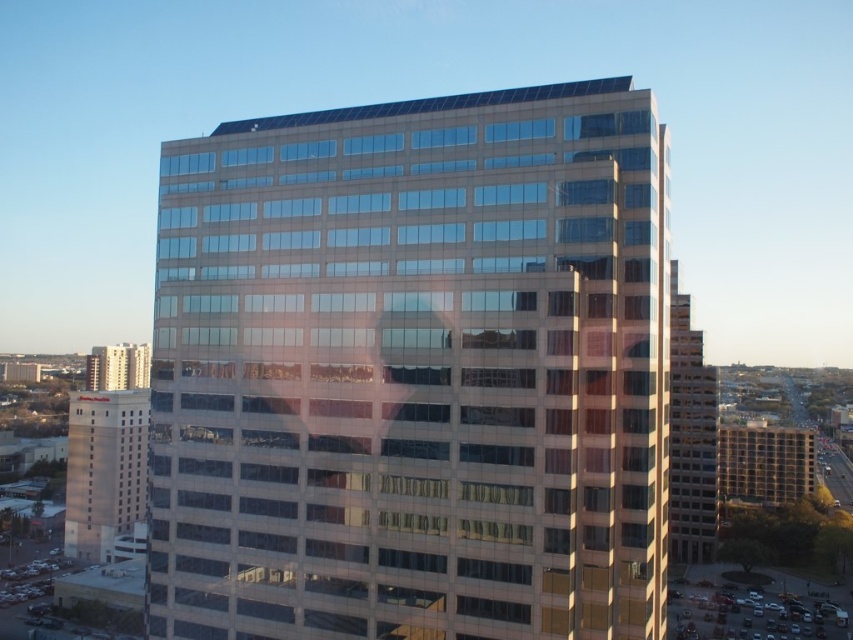
Can you confirm if glassy beige building at center is bigger than beige concrete hotel at lower left?

No, glassy beige building at center is not bigger than beige concrete hotel at lower left.

Is glassy beige building at center wider than beige concrete hotel at lower left?

Incorrect, glassy beige building at center's width does not surpass beige concrete hotel at lower left's.

Between point (550, 419) and point (93, 541), which one is positioned in front?

Point (550, 419)

The image size is (853, 640). Identify the location of glassy beige building at center. (415, 371).

Can you confirm if glassy beige building at center is shorter than matte glass building at left?

No, glassy beige building at center is not shorter than matte glass building at left.

Does glassy beige building at center appear on the right side of matte glass building at left?

Yes, glassy beige building at center is to the right of matte glass building at left.

The height and width of the screenshot is (640, 853). I want to click on glassy beige building at center, so click(415, 371).

Between glassy beige building at center and beige concrete building at right, which one appears on the right side from the viewer's perspective?

beige concrete building at right is more to the right.

Identify the location of glassy beige building at center. (415, 371).